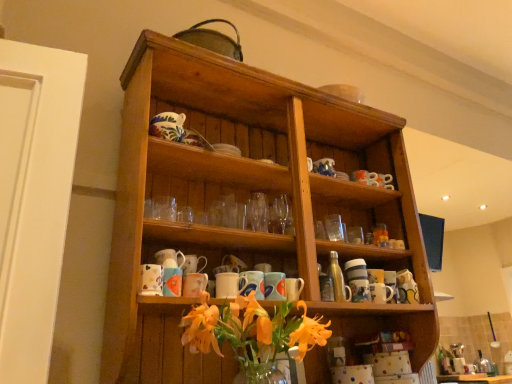
I want to click on matte ceramic mug at center, the 5th mug in the left-to-right sequence, so click(274, 286).

Locate an element on the screen. matte ceramic mug at lower center, the 1th mug viewed from the left is located at coordinates (151, 280).

How much space does matte ceramic mug at center, placed as the third mug when sorted from left to right, occupy horizontally?

matte ceramic mug at center, placed as the third mug when sorted from left to right, is 3.36 inches in width.

This screenshot has height=384, width=512. Find the location of `matte ceramic mug at center, placed as the third mug when sorted from left to right`. matte ceramic mug at center, placed as the third mug when sorted from left to right is located at coordinates (230, 285).

This screenshot has height=384, width=512. Describe the element at coordinates (360, 290) in the screenshot. I see `matte ceramic mug at center, positioned as the 1th mug in right-to-left order` at that location.

Where is `matte ceramic mug at center, acting as the third mug starting from the right`? The image size is (512, 384). matte ceramic mug at center, acting as the third mug starting from the right is located at coordinates (274, 286).

Considering the sizes of matte ceramic mug at center, the 5th mug in the left-to-right sequence, and matte ceramic mug at center, which ranks as the 7th mug in left-to-right order, in the image, is matte ceramic mug at center, the 5th mug in the left-to-right sequence, taller or shorter than matte ceramic mug at center, which ranks as the 7th mug in left-to-right order,?

Considering their sizes, matte ceramic mug at center, the 5th mug in the left-to-right sequence, has less height than matte ceramic mug at center, which ranks as the 7th mug in left-to-right order.

Is matte ceramic mug at center, acting as the third mug starting from the right, at the right side of matte ceramic mug at center, which ranks as the 7th mug in left-to-right order?

No, matte ceramic mug at center, acting as the third mug starting from the right, is not to the right of matte ceramic mug at center, which ranks as the 7th mug in left-to-right order.

Is matte ceramic mug at center, acting as the third mug starting from the right, not within matte ceramic mug at center, which ranks as the 7th mug in left-to-right order?

Yes, matte ceramic mug at center, acting as the third mug starting from the right, is located beyond the bounds of matte ceramic mug at center, which ranks as the 7th mug in left-to-right order.

From a real-world perspective, which object stands above the other?

In real-world perspective, matte ceramic mug at center, the 5th mug in the left-to-right sequence, is above.

Is matte ceramic mug at center, placed as the 5th mug when sorted from right to left, next to matte ceramic mug at center, positioned as the 1th mug in right-to-left order, and touching it?

No, matte ceramic mug at center, placed as the 5th mug when sorted from right to left, is not with matte ceramic mug at center, positioned as the 1th mug in right-to-left order.

Looking at this image, is matte ceramic mug at center, placed as the 5th mug when sorted from right to left, positioned with its back to matte ceramic mug at center, positioned as the 1th mug in right-to-left order?

No, matte ceramic mug at center, placed as the 5th mug when sorted from right to left, is not facing away from matte ceramic mug at center, positioned as the 1th mug in right-to-left order.

Which object is thinner, matte ceramic mug at center, placed as the 5th mug when sorted from right to left, or matte ceramic mug at center, which ranks as the 7th mug in left-to-right order?

Thinner between the two is matte ceramic mug at center, placed as the 5th mug when sorted from right to left.

From a real-world perspective, who is located higher, matte ceramic mug at center, placed as the 5th mug when sorted from right to left, or matte ceramic mug at center, which ranks as the 7th mug in left-to-right order?

matte ceramic mug at center, placed as the 5th mug when sorted from right to left, is physically above.

From the image's perspective, which is below, wooden shelf at center or metallic silver bottle at center-right?

From the image's view, metallic silver bottle at center-right is below.

Would you say wooden shelf at center is inside or outside metallic silver bottle at center-right?

wooden shelf at center lies outside metallic silver bottle at center-right.

Is wooden shelf at center to the left of metallic silver bottle at center-right from the viewer's perspective?

Yes.

Are wooden shelf at center and metallic silver bottle at center-right located far from each other?

wooden shelf at center is actually quite close to metallic silver bottle at center-right.

From the picture: Does matte ceramic mug at center, positioned as the 1th mug in right-to-left order, appear on the left side of matte ceramic mug at center, the second mug positioned from the right?

In fact, matte ceramic mug at center, positioned as the 1th mug in right-to-left order, is to the right of matte ceramic mug at center, the second mug positioned from the right.

Looking at this image, who is taller, matte ceramic mug at center, positioned as the 1th mug in right-to-left order, or matte ceramic mug at center, the second mug positioned from the right?

Standing taller between the two is matte ceramic mug at center, positioned as the 1th mug in right-to-left order.

Which object is further away from the camera taking this photo, matte ceramic mug at center, positioned as the 1th mug in right-to-left order, or matte ceramic mug at center, the second mug positioned from the right?

matte ceramic mug at center, positioned as the 1th mug in right-to-left order, is more distant.

Who is smaller, matte ceramic mug at center, positioned as the 1th mug in right-to-left order, or matte ceramic mug at center, the second mug positioned from the right?

Smaller between the two is matte ceramic mug at center, the second mug positioned from the right.

From the picture: Is matte ceramic mug at lower center, the 1th mug viewed from the left, positioned before matte ceramic mug at center, which ranks as the 7th mug in left-to-right order?

Yes, matte ceramic mug at lower center, the 1th mug viewed from the left, is in front of matte ceramic mug at center, which ranks as the 7th mug in left-to-right order.

In the image, is matte ceramic mug at lower center, the seventh mug when ordered from right to left, on the left side or the right side of matte ceramic mug at center, which ranks as the 7th mug in left-to-right order?

From the image, it's evident that matte ceramic mug at lower center, the seventh mug when ordered from right to left, is to the left of matte ceramic mug at center, which ranks as the 7th mug in left-to-right order.

From a real-world perspective, relative to matte ceramic mug at center, which ranks as the 7th mug in left-to-right order, is matte ceramic mug at lower center, the seventh mug when ordered from right to left, vertically above or below?

matte ceramic mug at lower center, the seventh mug when ordered from right to left, is situated lower than matte ceramic mug at center, which ranks as the 7th mug in left-to-right order, in the real world.

Is there a large distance between matte ceramic mug at lower center, the seventh mug when ordered from right to left, and matte ceramic mug at center, positioned as the 1th mug in right-to-left order?

No.

Which object is wider, matte ceramic mug at lower center, the seventh mug when ordered from right to left, or matte ceramic mug at center, which appears as the 6th mug when viewed from the right?

matte ceramic mug at center, which appears as the 6th mug when viewed from the right, is wider.

Is matte ceramic mug at lower center, the seventh mug when ordered from right to left, placed right next to matte ceramic mug at center, which appears as the second mug when viewed from the left?

No, matte ceramic mug at lower center, the seventh mug when ordered from right to left, is not with matte ceramic mug at center, which appears as the second mug when viewed from the left.

Based on the photo, which object is more forward, matte ceramic mug at lower center, the 1th mug viewed from the left, or matte ceramic mug at center, which appears as the 6th mug when viewed from the right?

matte ceramic mug at lower center, the 1th mug viewed from the left.

Between matte ceramic mug at center, the second mug positioned from the right, and matte ceramic mug at center, which is the 4th mug in left-to-right order, which one is positioned in front?

matte ceramic mug at center, which is the 4th mug in left-to-right order, is in front.

Does matte ceramic mug at center, the second mug positioned from the right, contain matte ceramic mug at center, arranged as the 4th mug when viewed from the right?

No, matte ceramic mug at center, the second mug positioned from the right, does not contain matte ceramic mug at center, arranged as the 4th mug when viewed from the right.

From a real-world perspective, starting from the matte ceramic mug at center, arranged as the 4th mug when viewed from the right, which mug is the 5th one below it? Please provide its 2D coordinates.

[(293, 288)]

Where is `mug that is the 3rd object directly below the matte ceramic mug at center, the 5th mug in the left-to-right sequence (from a real-world perspective)`? Image resolution: width=512 pixels, height=384 pixels. mug that is the 3rd object directly below the matte ceramic mug at center, the 5th mug in the left-to-right sequence (from a real-world perspective) is located at coordinates (360, 290).

From a real-world perspective, which mug is the 1st one above the matte ceramic mug at center, positioned as the 1th mug in right-to-left order? Please provide its 2D coordinates.

[(230, 285)]

When comparing their distances from matte ceramic mug at center, which appears as the second mug when viewed from the left, does matte ceramic mug at center, arranged as the 4th mug when viewed from the right, or matte ceramic mug at center, acting as the third mug starting from the right, seem further?

matte ceramic mug at center, acting as the third mug starting from the right, lies further to matte ceramic mug at center, which appears as the second mug when viewed from the left, than the other object.

Consider the image. Considering their positions, is metallic silver bottle at center-right positioned further to wooden shelf at center than matte ceramic mug at center, the 5th mug in the left-to-right sequence?

metallic silver bottle at center-right is positioned further to the anchor wooden shelf at center.

In the scene shown: Based on their spatial positions, is matte ceramic mug at center, which is the 4th mug in left-to-right order, or wooden shelf at center further from metallic silver bottle at center-right?

wooden shelf at center is positioned further to the anchor metallic silver bottle at center-right.

Looking at the image, which one is located further to matte ceramic mug at center, the second mug positioned from the right, matte ceramic mug at center, which appears as the second mug when viewed from the left, or metallic silver bottle at center-right?

Based on the image, matte ceramic mug at center, which appears as the second mug when viewed from the left, appears to be further to matte ceramic mug at center, the second mug positioned from the right.

Which object lies further to the anchor point matte ceramic mug at center, acting as the sixth mug starting from the left, matte ceramic mug at lower center, the 1th mug viewed from the left, or matte ceramic mug at center, acting as the third mug starting from the right?

matte ceramic mug at lower center, the 1th mug viewed from the left.

Considering their positions, is matte ceramic mug at lower center, the 1th mug viewed from the left, positioned closer to matte ceramic mug at center, which ranks as the 7th mug in left-to-right order, than wooden shelf at center?

wooden shelf at center is closer to matte ceramic mug at center, which ranks as the 7th mug in left-to-right order.

From the image, which object appears to be farther from matte ceramic mug at center, positioned as the 1th mug in right-to-left order, matte ceramic mug at center, which appears as the second mug when viewed from the left, or matte ceramic mug at center, placed as the third mug when sorted from left to right?

matte ceramic mug at center, which appears as the second mug when viewed from the left, is positioned further to the anchor matte ceramic mug at center, positioned as the 1th mug in right-to-left order.

When comparing their distances from matte ceramic mug at lower center, the seventh mug when ordered from right to left, does metallic silver bottle at center-right or matte ceramic mug at center, arranged as the 4th mug when viewed from the right, seem further?

metallic silver bottle at center-right.

This screenshot has width=512, height=384. Identify the location of bottle between wooden shelf at center and matte ceramic mug at center, positioned as the 1th mug in right-to-left order, along the z-axis. (338, 279).

Locate an element on the screen. mug between matte ceramic mug at lower center, the seventh mug when ordered from right to left, and matte ceramic mug at center, placed as the third mug when sorted from left to right, from left to right is located at coordinates (194, 284).

Where is `mug located between matte ceramic mug at center, placed as the 5th mug when sorted from right to left, and matte ceramic mug at center, the 5th mug in the left-to-right sequence, in the left-right direction`? mug located between matte ceramic mug at center, placed as the 5th mug when sorted from right to left, and matte ceramic mug at center, the 5th mug in the left-to-right sequence, in the left-right direction is located at coordinates (253, 284).

Locate an element on the screen. bottle between matte ceramic mug at lower center, the seventh mug when ordered from right to left, and matte ceramic mug at center, positioned as the 1th mug in right-to-left order, from left to right is located at coordinates point(338,279).